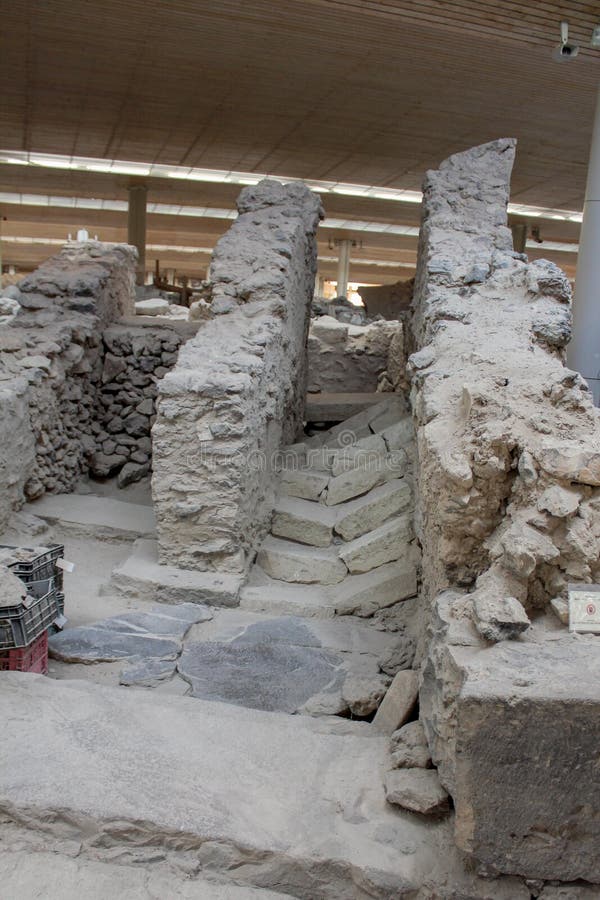
At what (x,y) coordinates should I click in order to perform the action: click on dusty black crate. Please return your answer as a coordinate pair (x, y). Looking at the image, I should click on (35, 615).